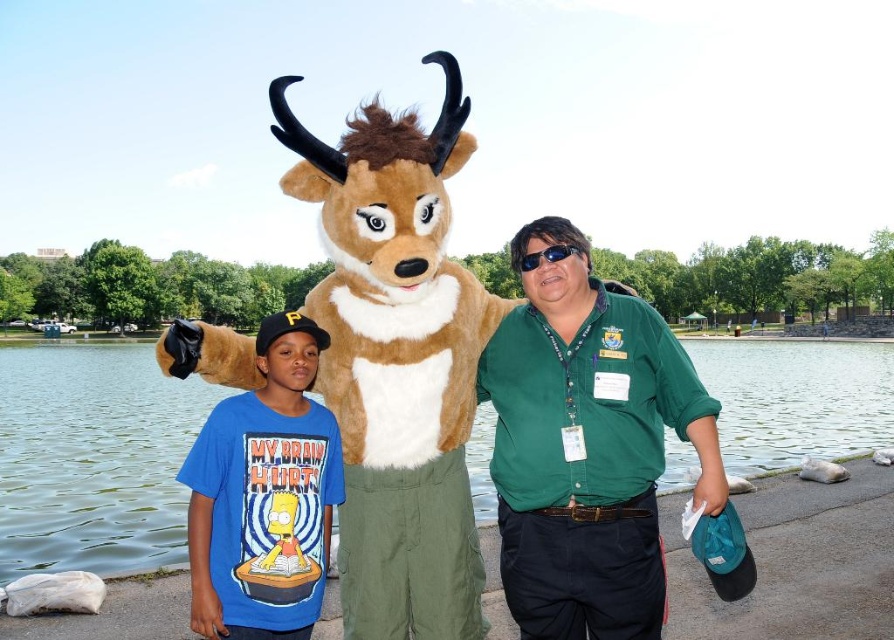
You are standing in the outdoor scene and want to move from the point at coordinates (787, 429) to the point at (321, 330). Which direction should you move to get closer to the latter?

You should move downward and to the left because point (321, 330) is located below and to the left of point (787, 429).